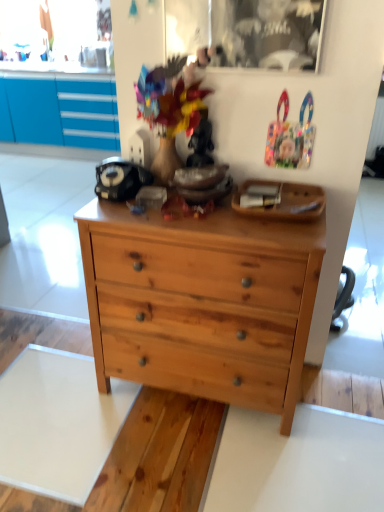
This screenshot has height=512, width=384. In order to click on free space above natural wood chest of drawers at center (from a real-world perspective) in this screenshot , I will do click(200, 209).